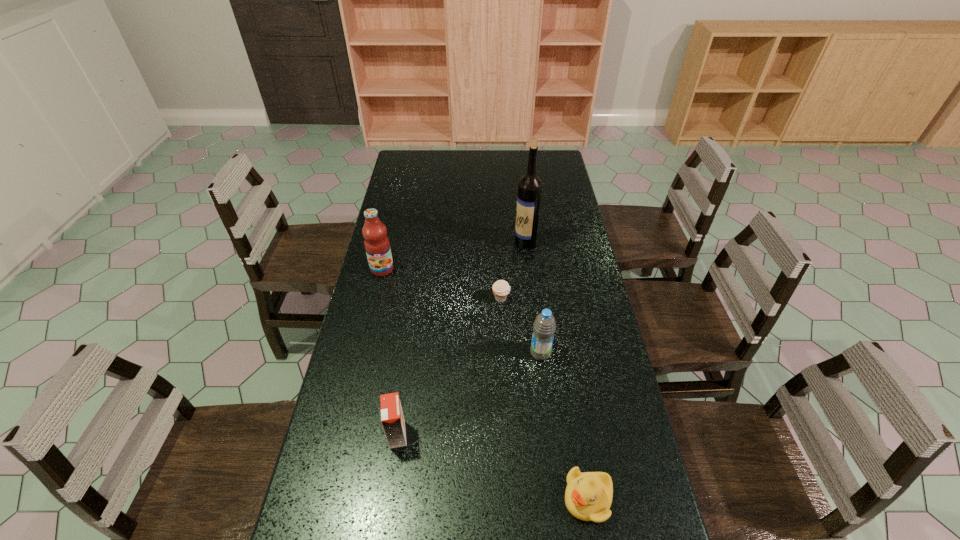
The height and width of the screenshot is (540, 960). I want to click on wine bottle, so click(x=530, y=185).

At what (x,y) coordinates should I click in order to perform the action: click on the tallest object. Please return your answer as a coordinate pair (x, y). Looking at the image, I should click on (530, 185).

The width and height of the screenshot is (960, 540). Identify the location of the leftmost object. (377, 245).

Where is `the second tallest object`? Image resolution: width=960 pixels, height=540 pixels. the second tallest object is located at coordinates (377, 245).

This screenshot has width=960, height=540. Identify the location of the fourth farthest object. (544, 326).

At what (x,y) coordinates should I click in order to perform the action: click on water bottle. Please return your answer as a coordinate pair (x, y). This screenshot has width=960, height=540. Looking at the image, I should click on (544, 326).

The image size is (960, 540). Find the location of `the second object from left to right`. the second object from left to right is located at coordinates (392, 418).

Find the location of a particular element. This screenshot has height=540, width=960. orange juice is located at coordinates (392, 418).

The width and height of the screenshot is (960, 540). I want to click on duckling, so click(588, 496).

The width and height of the screenshot is (960, 540). What are the coordinates of `the third farthest object` in the screenshot? It's located at (501, 288).